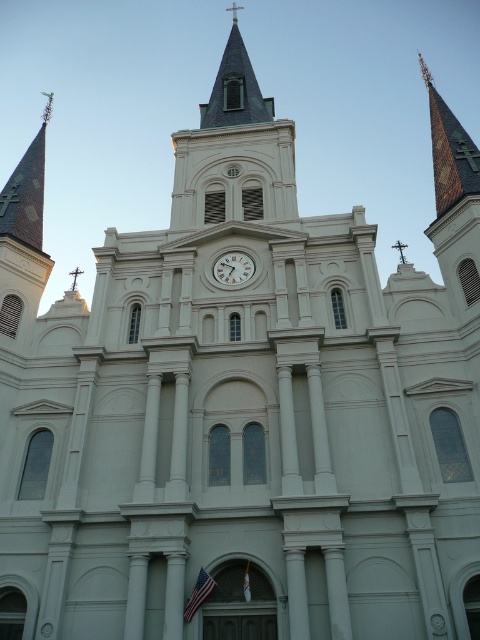
Does golden mosaic spire at upper right have a greater height compared to white glossy clock at center?

Correct, golden mosaic spire at upper right is much taller as white glossy clock at center.

Can you confirm if golden mosaic spire at upper right is smaller than white glossy clock at center?

Incorrect, golden mosaic spire at upper right is not smaller in size than white glossy clock at center.

Does point (444, 108) come farther from viewer compared to point (224, 276)?

Yes, point (444, 108) is farther from viewer.

You are a GUI agent. You are given a task and a screenshot of the screen. Output one action in this format:
    pyautogui.click(x=<x>, y=<y>)
    Task: Click on the golden mosaic spire at upper right
    
    Given the screenshot: What is the action you would take?
    click(450, 150)

Does dark gray slate spire at upper center appear on the left side of white glossy clock at center?

Indeed, dark gray slate spire at upper center is positioned on the left side of white glossy clock at center.

At what (x,y) coordinates should I click in order to perform the action: click on dark gray slate spire at upper center. Please return your answer as a coordinate pair (x, y). The image size is (480, 640). Looking at the image, I should click on (235, 88).

Where is `dark gray slate spire at upper center`? dark gray slate spire at upper center is located at coordinates (235, 88).

Find the location of `golden mosaic spire at upper right`. golden mosaic spire at upper right is located at coordinates (450, 150).

Can you confirm if golden mosaic spire at upper right is thinner than dark gray slate spire at upper center?

Incorrect, golden mosaic spire at upper right's width is not less than dark gray slate spire at upper center's.

Is point (434, 173) positioned after point (232, 109)?

No.

Find the location of `golden mosaic spire at upper right`. golden mosaic spire at upper right is located at coordinates (450, 150).